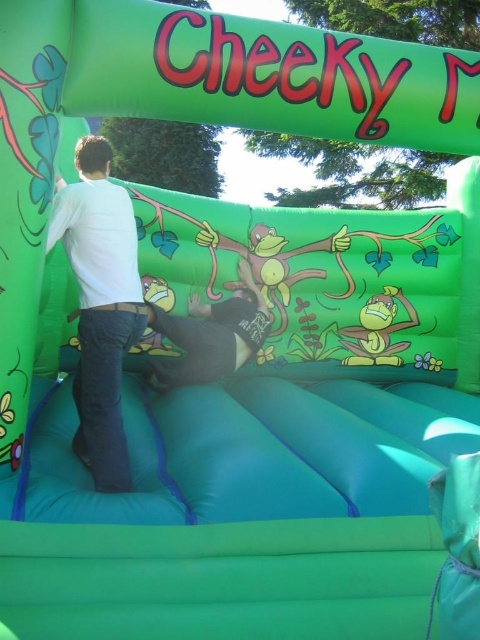
Question: Which object is the farthest from the soft black shirt at center?

Choices:
 (A) green rubber monkey at center
 (B) white matte shirt at left

Answer: (B)

Question: Does soft black shirt at center have a smaller size compared to green rubber monkey at center?

Choices:
 (A) no
 (B) yes

Answer: (A)

Question: Which point is closer to the camera?

Choices:
 (A) (376, 321)
 (B) (192, 348)
 (C) (79, 234)

Answer: (C)

Question: Which point is closer to the camera?

Choices:
 (A) (352, 333)
 (B) (191, 365)

Answer: (B)

Question: Does soft black shirt at center appear under green rubber monkey at center?

Choices:
 (A) no
 (B) yes

Answer: (A)

Question: Is white matte shirt at left smaller than green rubber monkey at center?

Choices:
 (A) yes
 (B) no

Answer: (B)